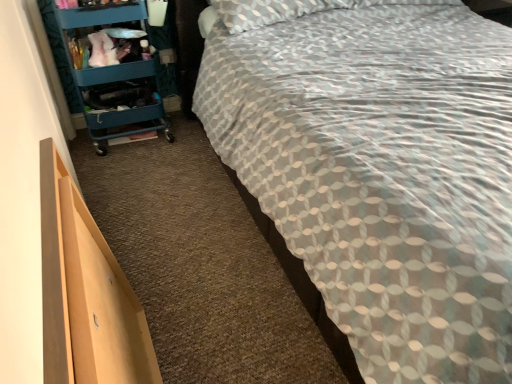
Question: Is teal plastic cart at left outside patterned fabric bed at center?

Choices:
 (A) no
 (B) yes

Answer: (B)

Question: Is patterned fabric bed at center located within teal plastic cart at left?

Choices:
 (A) no
 (B) yes

Answer: (A)

Question: Can you confirm if teal plastic cart at left is smaller than patterned fabric bed at center?

Choices:
 (A) no
 (B) yes

Answer: (B)

Question: Can you confirm if teal plastic cart at left is shorter than patterned fabric bed at center?

Choices:
 (A) yes
 (B) no

Answer: (A)

Question: Does teal plastic cart at left appear on the right side of patterned fabric bed at center?

Choices:
 (A) yes
 (B) no

Answer: (B)

Question: Considering the relative positions of teal plastic cart at left and patterned fabric bed at center in the image provided, is teal plastic cart at left to the left of patterned fabric bed at center from the viewer's perspective?

Choices:
 (A) yes
 (B) no

Answer: (A)

Question: Considering the relative positions of light wood drawer at lower left and patterned fabric bed at center in the image provided, is light wood drawer at lower left to the right of patterned fabric bed at center from the viewer's perspective?

Choices:
 (A) no
 (B) yes

Answer: (A)

Question: From a real-world perspective, is light wood drawer at lower left positioned over patterned fabric bed at center based on gravity?

Choices:
 (A) yes
 (B) no

Answer: (B)

Question: Is light wood drawer at lower left further to the viewer compared to patterned fabric bed at center?

Choices:
 (A) no
 (B) yes

Answer: (B)

Question: Is light wood drawer at lower left wider than patterned fabric bed at center?

Choices:
 (A) no
 (B) yes

Answer: (A)

Question: From the image's perspective, is light wood drawer at lower left over patterned fabric bed at center?

Choices:
 (A) no
 (B) yes

Answer: (A)

Question: Is the position of light wood drawer at lower left less distant than that of patterned fabric bed at center?

Choices:
 (A) yes
 (B) no

Answer: (B)

Question: Is patterned fabric bed at center not near light wood drawer at lower left?

Choices:
 (A) yes
 (B) no

Answer: (B)